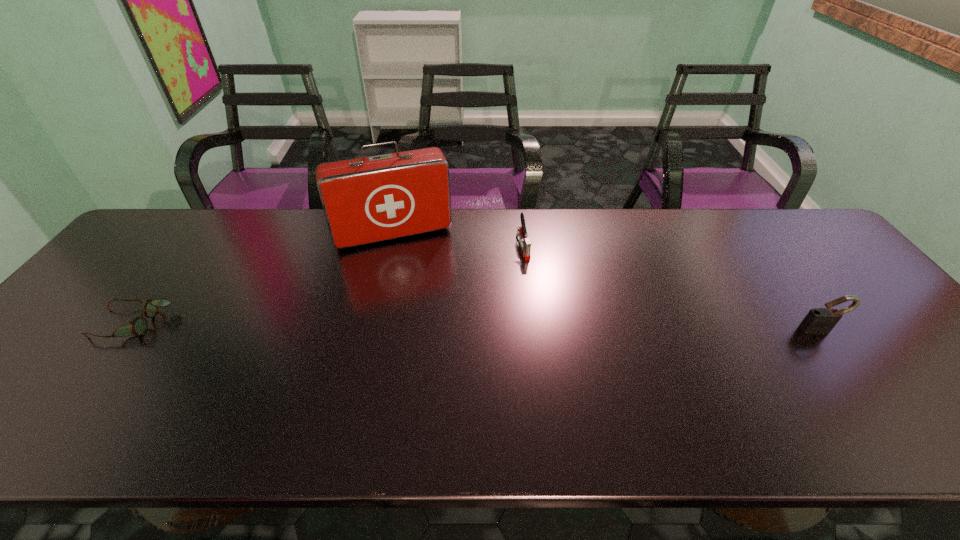
The width and height of the screenshot is (960, 540). What are the coordinates of `vacant space in between the stapler and the padlock` in the screenshot? It's located at (671, 288).

Find the location of a particular element. vacant area between the shortest object and the second object from left to right is located at coordinates (263, 279).

Find the location of a particular element. This screenshot has height=540, width=960. free space between the padlock and the first-aid kit is located at coordinates (607, 282).

What are the coordinates of `free point between the tallest object and the third shortest object` in the screenshot? It's located at (607, 282).

The width and height of the screenshot is (960, 540). What are the coordinates of `free spot between the spectacles and the third tallest object` in the screenshot? It's located at (328, 285).

Identify which object is the second closest to the second object from left to right. Please provide its 2D coordinates. Your answer should be formatted as a tuple, i.e. [(x, y)], where the tuple contains the x and y coordinates of a point satisfying the conditions above.

[(138, 326)]

Identify the location of the second closest object to the third tallest object. The width and height of the screenshot is (960, 540). (820, 320).